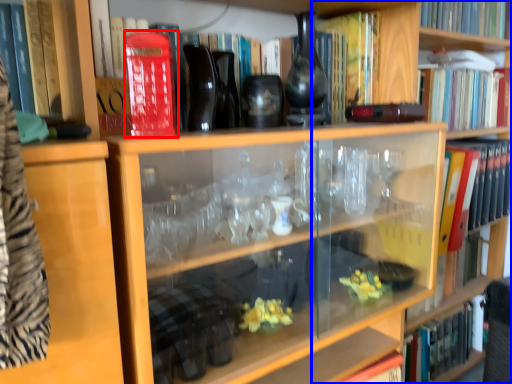
Question: Which object appears closest to the camera in this image, paperback book (highlighted by a red box) or bookshelf (highlighted by a blue box)?

Choices:
 (A) paperback book
 (B) bookshelf

Answer: (A)